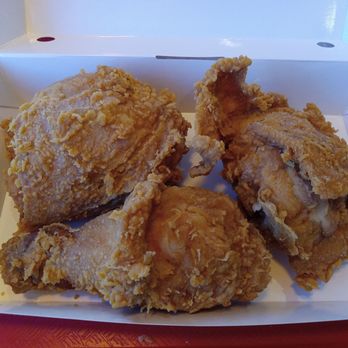
Identify the location of box. (137, 41).